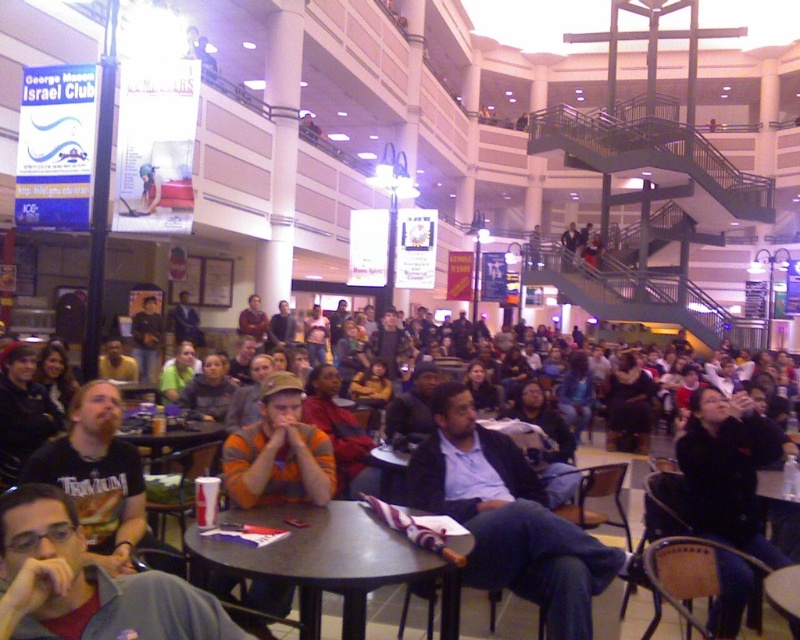
Question: Estimate the real-world distances between objects in this image. Which object is farther from the light blue shirt at center?

Choices:
 (A) black leather jacket at lower right
 (B) black t-shirt at lower left

Answer: (B)

Question: Among these objects, which one is nearest to the camera?

Choices:
 (A) gray fabric shirt at lower left
 (B) metallic gray table at center

Answer: (A)

Question: Is gray fabric shirt at lower left wider than black t-shirt at lower left?

Choices:
 (A) no
 (B) yes

Answer: (A)

Question: Can you confirm if light blue shirt at center is positioned above black leather jacket at lower right?

Choices:
 (A) no
 (B) yes

Answer: (A)

Question: Which point appears closest to the camera in this image?

Choices:
 (A) (121, 545)
 (B) (540, 566)

Answer: (B)

Question: Can you confirm if black leather jacket at lower right is positioned to the right of black t-shirt at lower left?

Choices:
 (A) yes
 (B) no

Answer: (A)